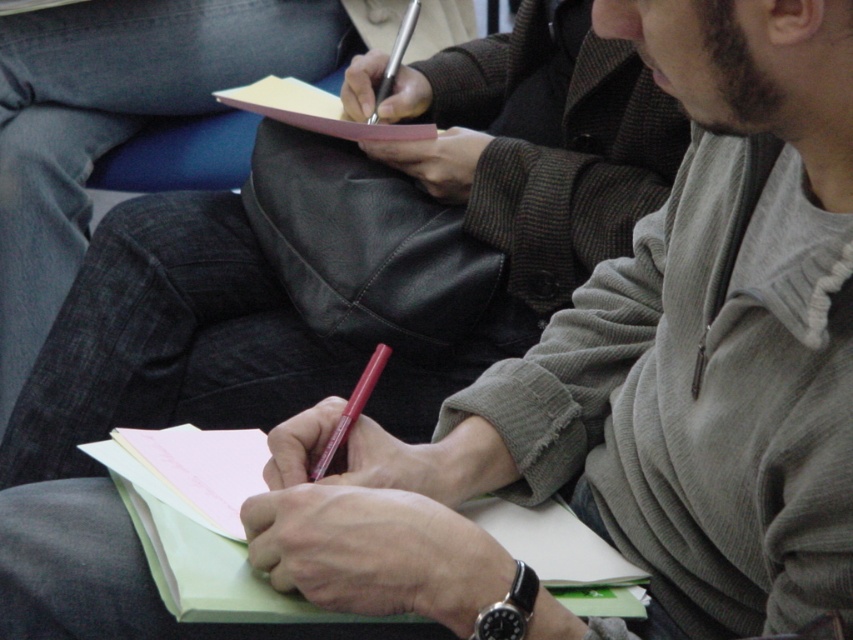
Question: Which point is closer to the camera?

Choices:
 (A) (386, 76)
 (B) (347, 422)

Answer: (B)

Question: Is the position of matte pink pencil at center less distant than that of metallic silver pen at upper center?

Choices:
 (A) no
 (B) yes

Answer: (B)

Question: Is matte pink pencil at center to the left of metallic silver pen at upper center from the viewer's perspective?

Choices:
 (A) no
 (B) yes

Answer: (A)

Question: Which point is farther from the camera taking this photo?

Choices:
 (A) (351, 412)
 (B) (376, 131)

Answer: (B)

Question: Which object appears farthest from the camera in this image?

Choices:
 (A) metallic silver pen at upper center
 (B) pink paper at center
 (C) matte pink pencil at center

Answer: (A)

Question: In this image, where is pink paper at center located relative to matte pink pencil at center?

Choices:
 (A) right
 (B) left

Answer: (B)